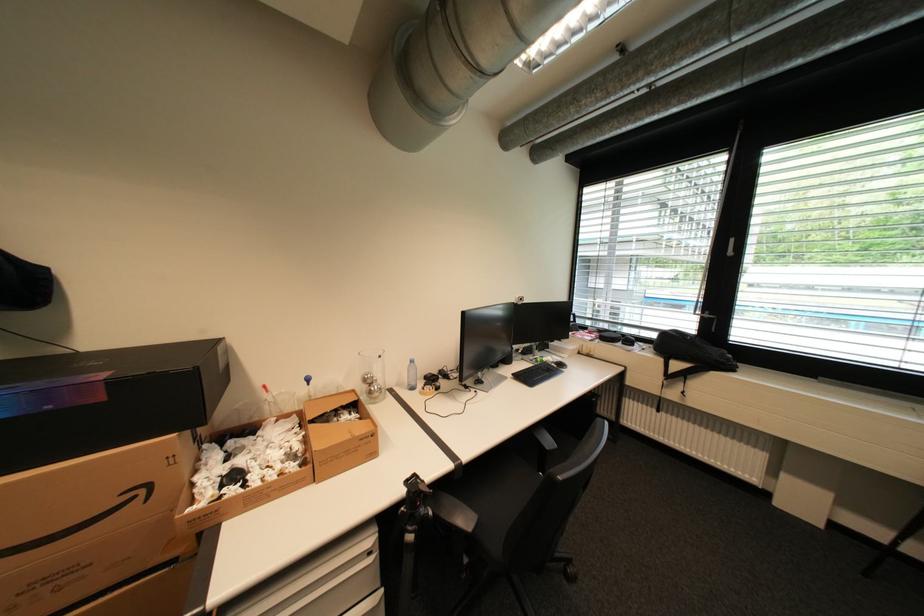
I want to click on black chair armrest, so click(434, 506).